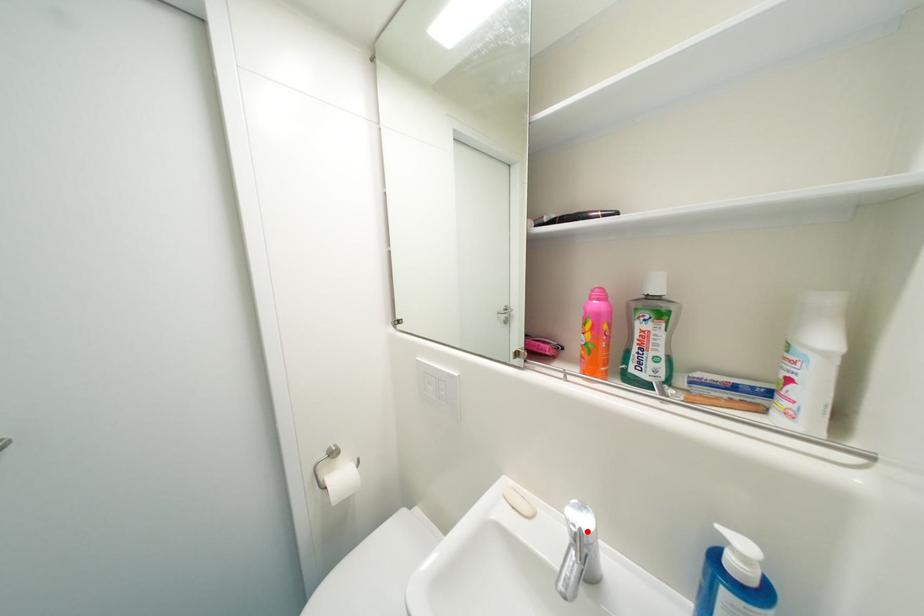
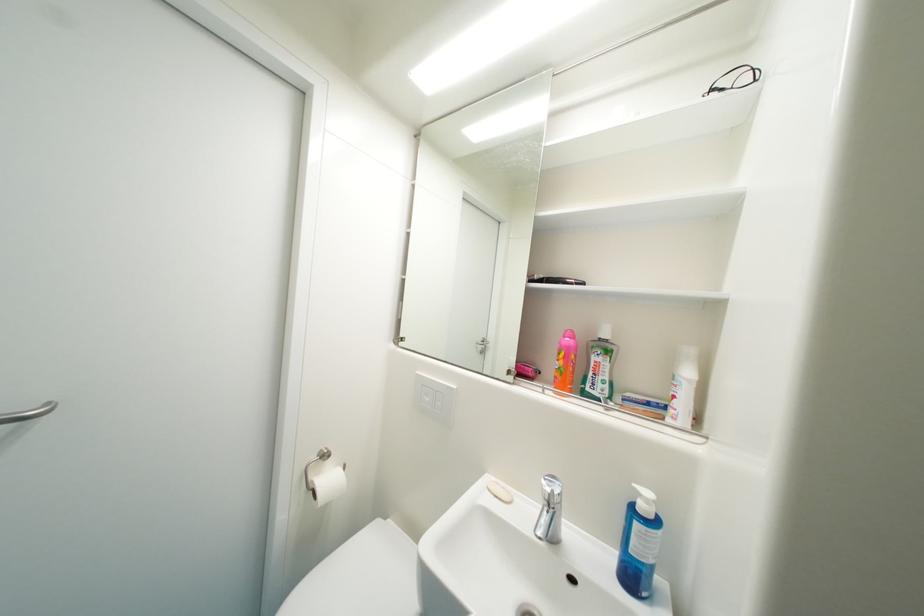
Where in the second image is the point corresponding to the highlighted location from the first image?

(560, 493)